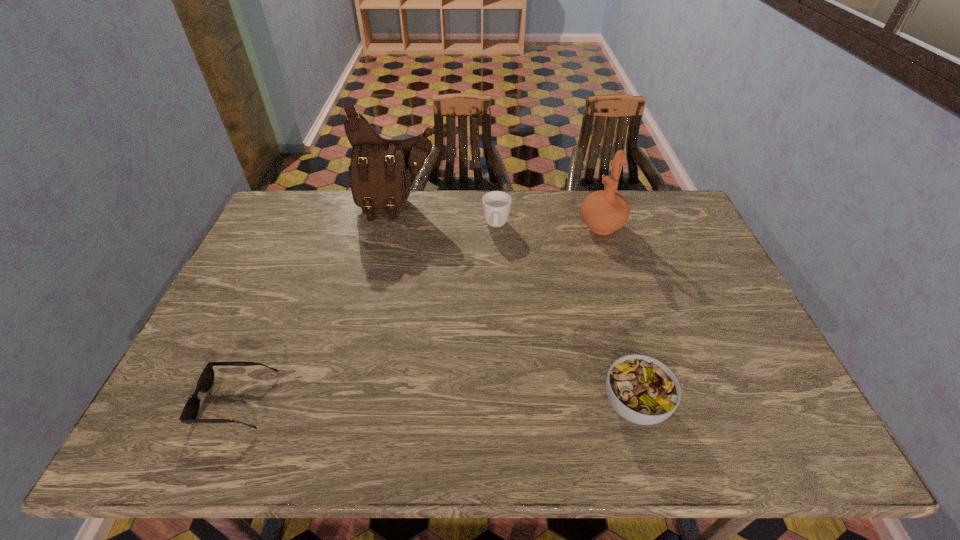
Locate which object ranks fourth in proximity to the shoulder bag. Please provide its 2D coordinates. Your answer should be formatted as a tuple, i.e. [(x, y)], where the tuple contains the x and y coordinates of a point satisfying the conditions above.

[(643, 390)]

The width and height of the screenshot is (960, 540). Identify the location of free spot that satisfies the following two spatial constraints: 1. on the back side of the fourth shortest object; 2. on the right side of the soup bowl. (587, 226).